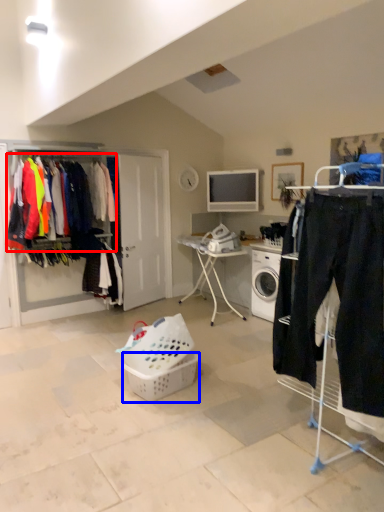
Question: Which point is closer to the camera, clothing (highlighted by a red box) or basket (highlighted by a blue box)?

Choices:
 (A) clothing
 (B) basket

Answer: (B)